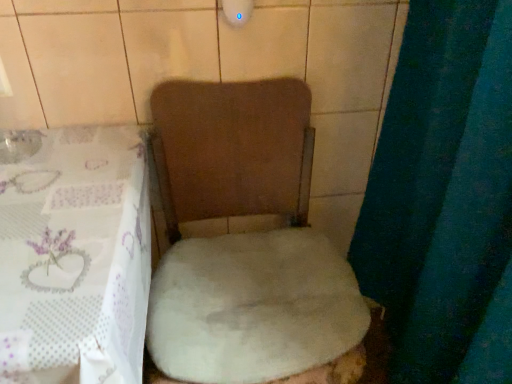
Question: Is the surface of white fluffy toilet at center in direct contact with white sheer tablecloth at lower left?

Choices:
 (A) no
 (B) yes

Answer: (A)

Question: Is white fluffy toilet at center wider than white sheer tablecloth at lower left?

Choices:
 (A) yes
 (B) no

Answer: (B)

Question: Is white fluffy toilet at center to the right of white sheer tablecloth at lower left from the viewer's perspective?

Choices:
 (A) yes
 (B) no

Answer: (A)

Question: Is white fluffy toilet at center thinner than white sheer tablecloth at lower left?

Choices:
 (A) no
 (B) yes

Answer: (B)

Question: From a real-world perspective, is white fluffy toilet at center on top of white sheer tablecloth at lower left?

Choices:
 (A) yes
 (B) no

Answer: (A)

Question: From a real-world perspective, is white fluffy rug at center above or below white fluffy toilet at center?

Choices:
 (A) above
 (B) below

Answer: (A)

Question: Considering the positions of white fluffy rug at center and white fluffy toilet at center in the image, is white fluffy rug at center wider or thinner than white fluffy toilet at center?

Choices:
 (A) thin
 (B) wide

Answer: (A)

Question: Is white fluffy rug at center inside the boundaries of white fluffy toilet at center, or outside?

Choices:
 (A) outside
 (B) inside

Answer: (B)

Question: From the image's perspective, is white fluffy rug at center positioned above or below white fluffy toilet at center?

Choices:
 (A) below
 (B) above

Answer: (B)

Question: Does point (356, 367) appear closer or farther from the camera than point (49, 283)?

Choices:
 (A) closer
 (B) farther

Answer: (B)

Question: Is white fluffy toilet at center spatially inside white sheer tablecloth at lower left, or outside of it?

Choices:
 (A) outside
 (B) inside

Answer: (A)

Question: Considering their positions, is white fluffy toilet at center located in front of or behind white sheer tablecloth at lower left?

Choices:
 (A) front
 (B) behind

Answer: (B)

Question: Considering the positions of white fluffy toilet at center and white sheer tablecloth at lower left in the image, is white fluffy toilet at center wider or thinner than white sheer tablecloth at lower left?

Choices:
 (A) wide
 (B) thin

Answer: (B)

Question: Considering the positions of white sheer tablecloth at lower left and white fluffy toilet at center in the image, is white sheer tablecloth at lower left bigger or smaller than white fluffy toilet at center?

Choices:
 (A) small
 (B) big

Answer: (B)

Question: Visually, is white sheer tablecloth at lower left positioned to the left or to the right of white fluffy toilet at center?

Choices:
 (A) right
 (B) left

Answer: (B)